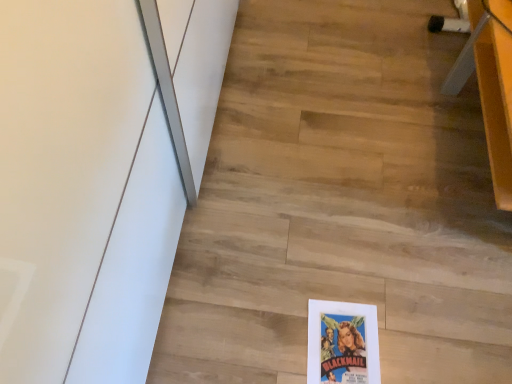
The height and width of the screenshot is (384, 512). In order to click on blank space above wooden floor at center (from a real-world perspective) in this screenshot , I will do `click(353, 233)`.